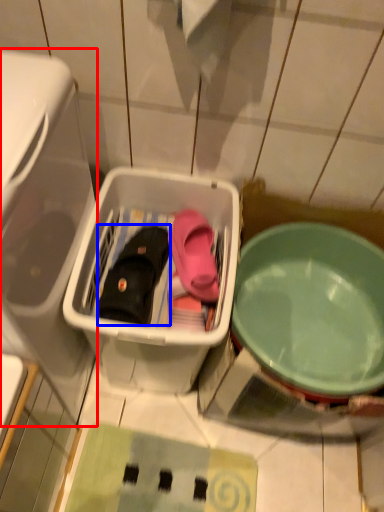
Question: Which point is closer to the camera, dish washer (highlighted by a red box) or footwear (highlighted by a blue box)?

Choices:
 (A) dish washer
 (B) footwear

Answer: (A)